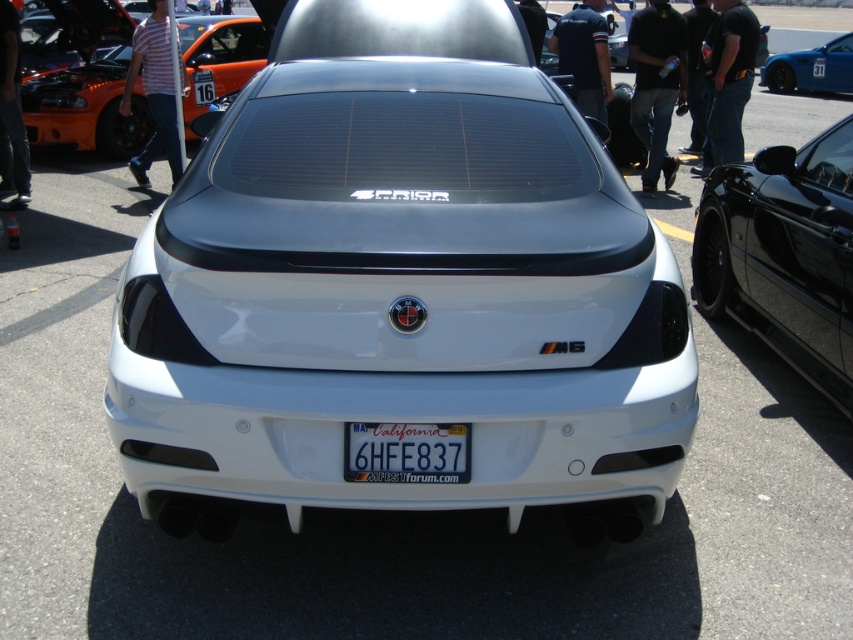
Please provide the 2D coordinates of the black glossy car at right as observed in the image.

The black glossy car at right is located at coordinates point (784, 253).

You are a photographer at a car event. You need to capture both the orange matte sports car at upper left and the blue glossy car at upper right in a single wide shot. Given their sizes, which car should you position closer to the camera to ensure both appear roughly the same size in the photo?

The orange matte sports car at upper left is smaller in size compared to the blue glossy car at upper right. To make both appear roughly the same size in the photo, you should position the orange matte sports car at upper left closer to the camera and move the blue glossy car at upper right farther away.

You are a photographer at a car show. You want to capture a photo of the white glossy car at center and the blue glossy car at upper right. Based on their positions, which car should you focus on first to ensure both are in frame?

The white glossy car at center is located below the blue glossy car at upper right, so you should focus on the blue glossy car at upper right first to ensure both are in frame.